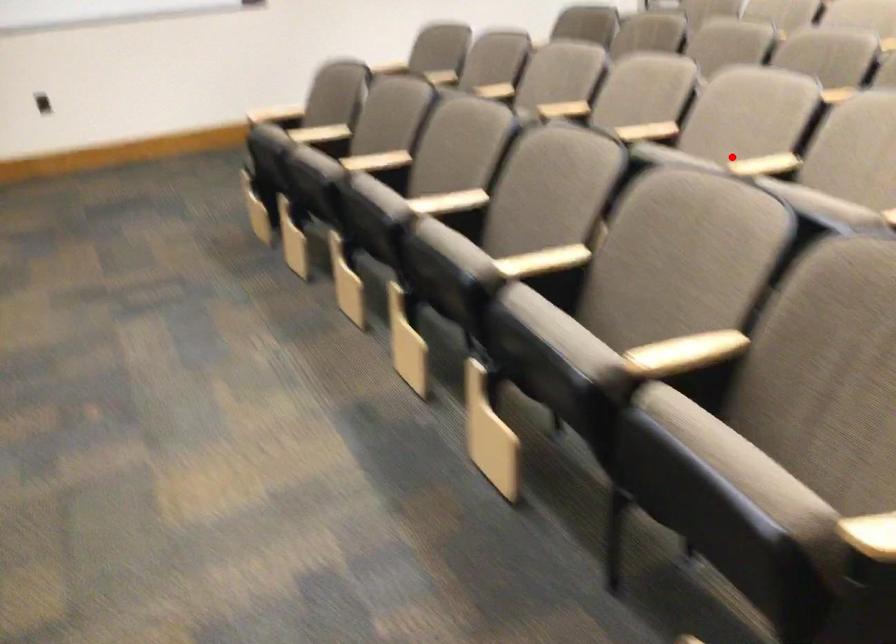
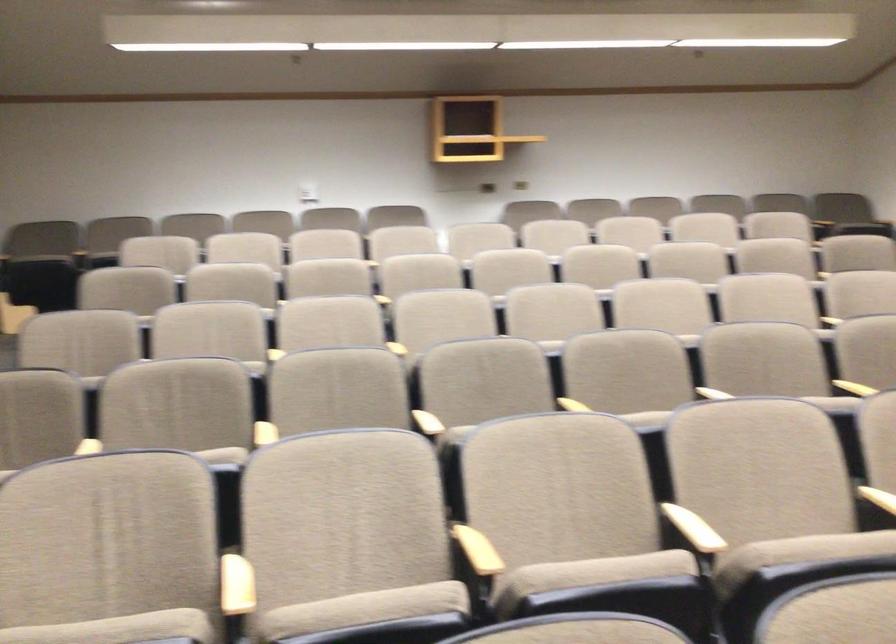
Question: I am providing you with two images of the same scene from different viewpoints. Image1 has a red point marked. In image2, the corresponding 3D location appears at what relative position? Reply with the corresponding letter.

Choices:
 (A) Closer
 (B) Farther

Answer: (A)